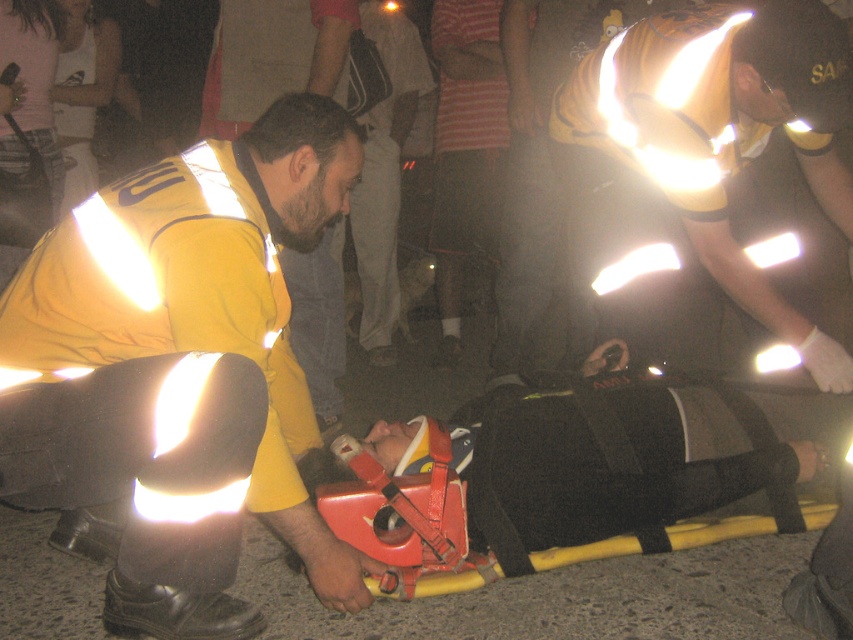
Based on the photo, does matte yellow uniform at center have a greater width compared to reflective yellow vest at center?

Incorrect, matte yellow uniform at center's width does not surpass reflective yellow vest at center's.

Can you confirm if matte yellow uniform at center is bigger than reflective yellow vest at center?

Result: Yes, matte yellow uniform at center is bigger than reflective yellow vest at center.

Image resolution: width=853 pixels, height=640 pixels. I want to click on matte yellow uniform at center, so click(x=178, y=368).